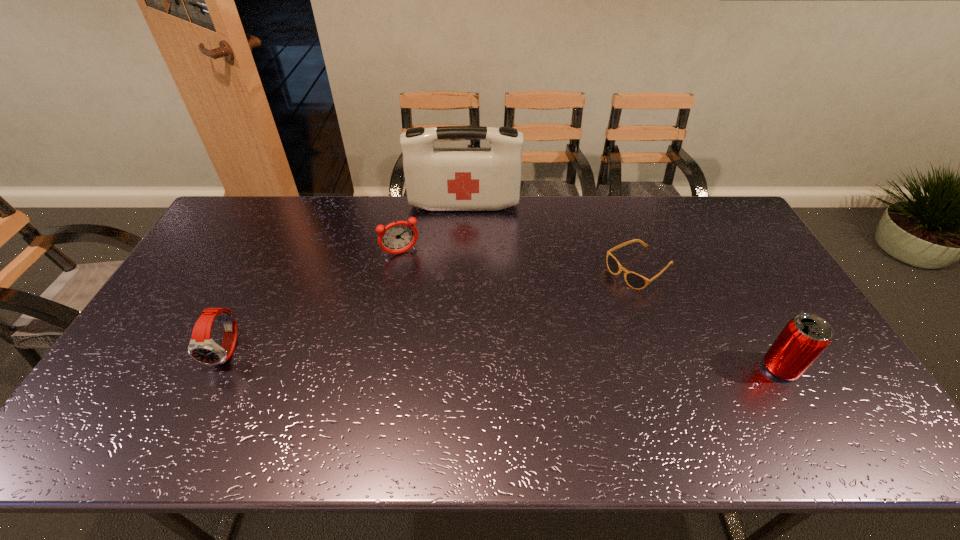
Find the location of a particular element. Image resolution: width=960 pixels, height=540 pixels. object that is at the near edge is located at coordinates (803, 339).

This screenshot has width=960, height=540. Identify the location of object that is at the right edge. (803, 339).

Identify the location of object located in the near right corner section of the desktop. (803, 339).

Identify the location of vacant space at the far edge of the desktop. (641, 225).

The image size is (960, 540). I want to click on free region at the near edge, so 612,402.

Find the location of a particular element. Image resolution: width=960 pixels, height=540 pixels. vacant space at the left edge of the desktop is located at coordinates (155, 332).

You are a GUI agent. You are given a task and a screenshot of the screen. Output one action in this format:
    pyautogui.click(x=<x>, y=<y>)
    Task: Click on the vacant space at the right edge of the desktop
    This screenshot has width=960, height=540.
    Given the screenshot: What is the action you would take?
    pyautogui.click(x=780, y=321)

Locate an element on the screen. The height and width of the screenshot is (540, 960). vacant region at the far right corner is located at coordinates (714, 208).

Locate an element on the screen. The image size is (960, 540). free spot between the alarm clock and the tallest object is located at coordinates (433, 229).

At what (x,y) coordinates should I click in order to perform the action: click on unoccupied area between the tallest object and the shortest object. Please return your answer as a coordinate pair (x, y). Looking at the image, I should click on (552, 237).